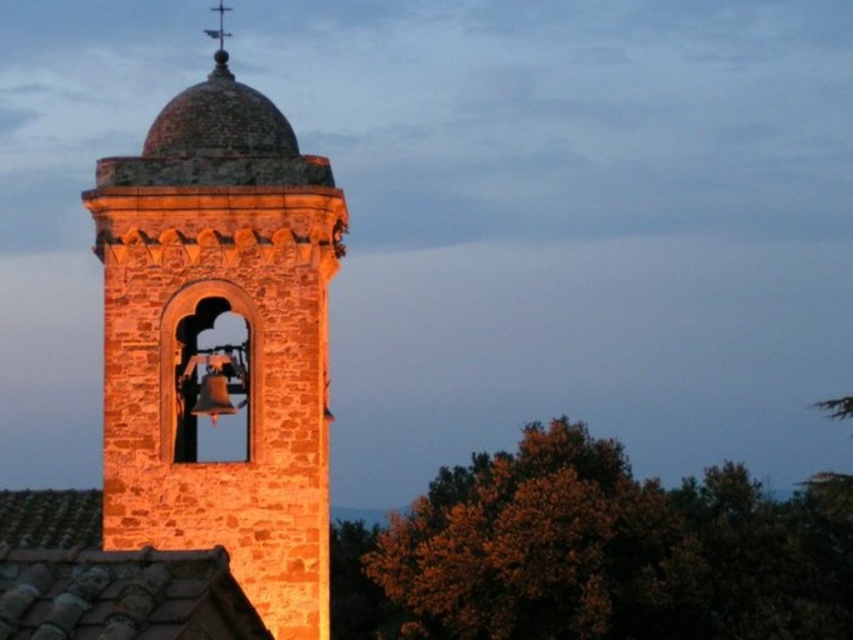
Question: From the image, what is the correct spatial relationship of rustic stone bell tower at center in relation to polished metal spire at upper center?

Choices:
 (A) above
 (B) below

Answer: (B)

Question: Which point is farther from the camera taking this photo?

Choices:
 (A) pyautogui.click(x=195, y=362)
 (B) pyautogui.click(x=215, y=76)

Answer: (B)

Question: Does rustic stone bell tower at center appear over polished metal spire at upper center?

Choices:
 (A) no
 (B) yes

Answer: (A)

Question: Does rustic stone bell tower at center appear on the right side of polished metal spire at upper center?

Choices:
 (A) no
 (B) yes

Answer: (B)

Question: Which point is farther to the camera?

Choices:
 (A) [309, 593]
 (B) [222, 48]

Answer: (B)